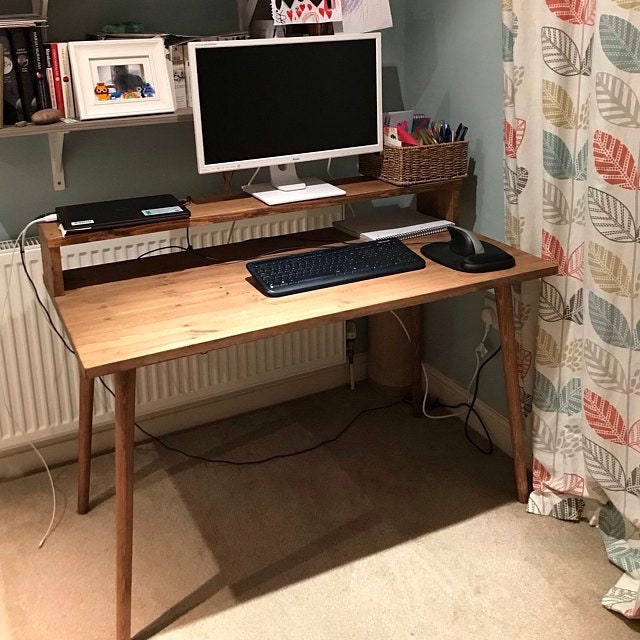
Where is `wireless router`? The image size is (640, 640). wireless router is located at coordinates (104, 221).